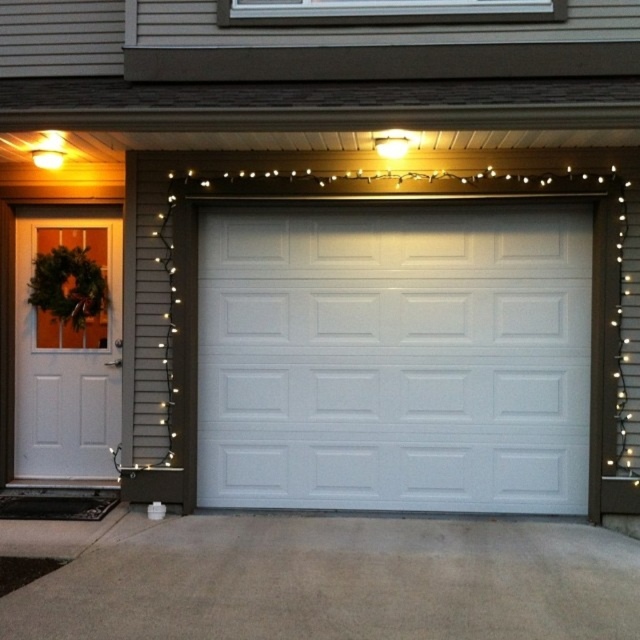
Question: Among these points, which one is nearest to the camera?

Choices:
 (A) (61, 161)
 (B) (250, 630)
 (C) (564, 276)

Answer: (B)

Question: Considering the relative positions of white painted wood garage door at center and gray concrete driveway at lower center in the image provided, where is white painted wood garage door at center located with respect to gray concrete driveway at lower center?

Choices:
 (A) right
 (B) left

Answer: (A)

Question: Can you confirm if white painted wood garage door at center is smaller than white matte door at left?

Choices:
 (A) no
 (B) yes

Answer: (A)

Question: Considering the real-world distances, which object is closest to the white matte door at left?

Choices:
 (A) white painted wood garage door at center
 (B) gray concrete driveway at lower center

Answer: (A)

Question: Which point is farther to the camera?

Choices:
 (A) matte yellow light bulb at upper left
 (B) white painted wood garage door at center
 (C) gray concrete driveway at lower center

Answer: (B)

Question: Does white matte door at left have a larger size compared to matte yellow light bulb at upper left?

Choices:
 (A) yes
 (B) no

Answer: (A)